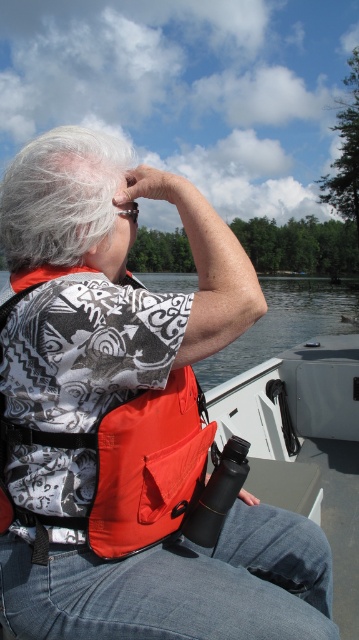
Is orange fabric life jacket at center wider than white fluffy hair at upper left?

No, orange fabric life jacket at center is not wider than white fluffy hair at upper left.

Who is higher up, orange fabric life jacket at center or white fluffy hair at upper left?

white fluffy hair at upper left

Where is `orange fabric life jacket at center`? Image resolution: width=359 pixels, height=640 pixels. orange fabric life jacket at center is located at coordinates (131, 465).